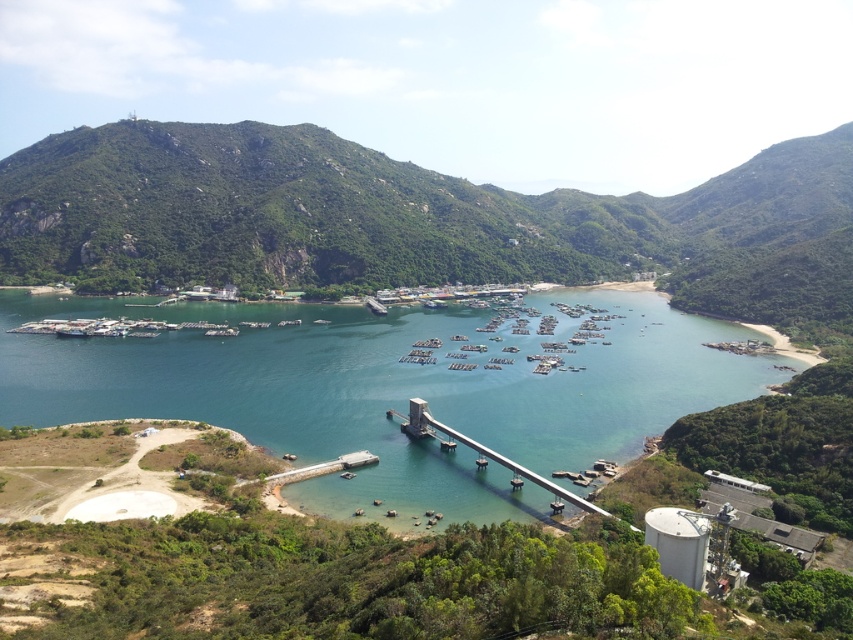
Question: Which of the following is the farthest from the observer?

Choices:
 (A) clear blue water at center
 (B) metallic gray bridge at center
 (C) green leafy mountain at center

Answer: (C)

Question: Which point appears closest to the camera in this image?

Choices:
 (A) (729, 275)
 (B) (413, 429)
 (C) (428, 448)

Answer: (C)

Question: Can you confirm if green leafy mountain at center is smaller than metallic gray bridge at center?

Choices:
 (A) no
 (B) yes

Answer: (A)

Question: Which object is positioned farthest from the metallic gray bridge at center?

Choices:
 (A) green leafy mountain at center
 (B) clear blue water at center

Answer: (A)

Question: Is green leafy mountain at center wider than metallic gray bridge at center?

Choices:
 (A) yes
 (B) no

Answer: (A)

Question: Where is green leafy mountain at center located in relation to metallic gray bridge at center in the image?

Choices:
 (A) right
 (B) left

Answer: (A)